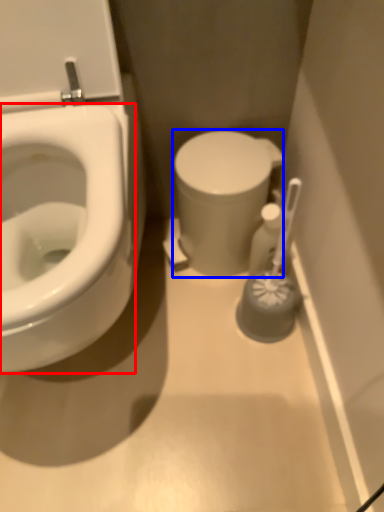
Question: Which object appears farthest to the camera in this image, bidet (highlighted by a red box) or porcelain (highlighted by a blue box)?

Choices:
 (A) bidet
 (B) porcelain

Answer: (B)